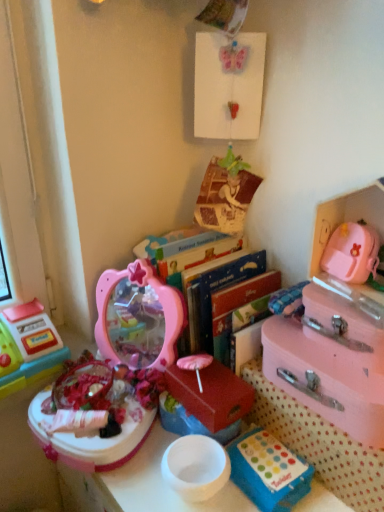
Question: Considering the relative sizes of pink matte suitcase at right, which appears as the 1th storage box when viewed from the right, and plastic toy cash register at left, the first toy in the left-to-right sequence, in the image provided, is pink matte suitcase at right, which appears as the 1th storage box when viewed from the right, bigger than plastic toy cash register at left, the first toy in the left-to-right sequence,?

Choices:
 (A) yes
 (B) no

Answer: (A)

Question: Can you see pink matte suitcase at right, the 4th storage box positioned from the left, touching plastic toy cash register at left, the first toy in the left-to-right sequence?

Choices:
 (A) no
 (B) yes

Answer: (A)

Question: Is pink matte suitcase at right, which appears as the 1th storage box when viewed from the right, wider than plastic toy cash register at left, the first toy in the left-to-right sequence?

Choices:
 (A) yes
 (B) no

Answer: (A)

Question: Is plastic toy cash register at left, the first toy in the left-to-right sequence, located within pink matte suitcase at right, the 4th storage box positioned from the left?

Choices:
 (A) no
 (B) yes

Answer: (A)

Question: Is pink matte suitcase at right, which appears as the 1th storage box when viewed from the right, turned away from plastic toy cash register at left, the 2th toy viewed from the right?

Choices:
 (A) no
 (B) yes

Answer: (A)

Question: Is point (360, 387) positioned closer to the camera than point (203, 339)?

Choices:
 (A) closer
 (B) farther

Answer: (A)

Question: Considering the positions of pink matte suitcase at right, which appears as the 1th storage box when viewed from the right, and hardcover books at center in the image, is pink matte suitcase at right, which appears as the 1th storage box when viewed from the right, bigger or smaller than hardcover books at center?

Choices:
 (A) small
 (B) big

Answer: (A)

Question: Which is correct: pink matte suitcase at right, the 4th storage box positioned from the left, is inside hardcover books at center, or outside of it?

Choices:
 (A) outside
 (B) inside

Answer: (A)

Question: From a real-world perspective, is pink matte suitcase at right, the 4th storage box positioned from the left, physically located above or below hardcover books at center?

Choices:
 (A) above
 (B) below

Answer: (A)

Question: Is point (79, 439) positioned closer to the camera than point (311, 471)?

Choices:
 (A) closer
 (B) farther

Answer: (B)

Question: Is pink plastic mirror at center, the 1th toy positioned from the right, inside the boundaries of blue plastic storage box at lower center, acting as the 3th storage box starting from the right, or outside?

Choices:
 (A) inside
 (B) outside

Answer: (B)

Question: In terms of size, does pink plastic mirror at center, the 1th toy positioned from the right, appear bigger or smaller than blue plastic storage box at lower center, acting as the 3th storage box starting from the right?

Choices:
 (A) big
 (B) small

Answer: (A)

Question: In the image, is pink plastic mirror at center, placed as the second toy when sorted from left to right, on the left side or the right side of blue plastic storage box at lower center, the 2th storage box positioned from the left?

Choices:
 (A) left
 (B) right

Answer: (A)

Question: From a real-world perspective, is pastel pink suitcase at right, which is the third storage box in left-to-right order, positioned above or below pink plastic mirror at center, placed as the second toy when sorted from left to right?

Choices:
 (A) above
 (B) below

Answer: (B)

Question: Would you say pastel pink suitcase at right, which is the third storage box in left-to-right order, is to the left or to the right of pink plastic mirror at center, placed as the second toy when sorted from left to right, in the picture?

Choices:
 (A) left
 (B) right

Answer: (B)